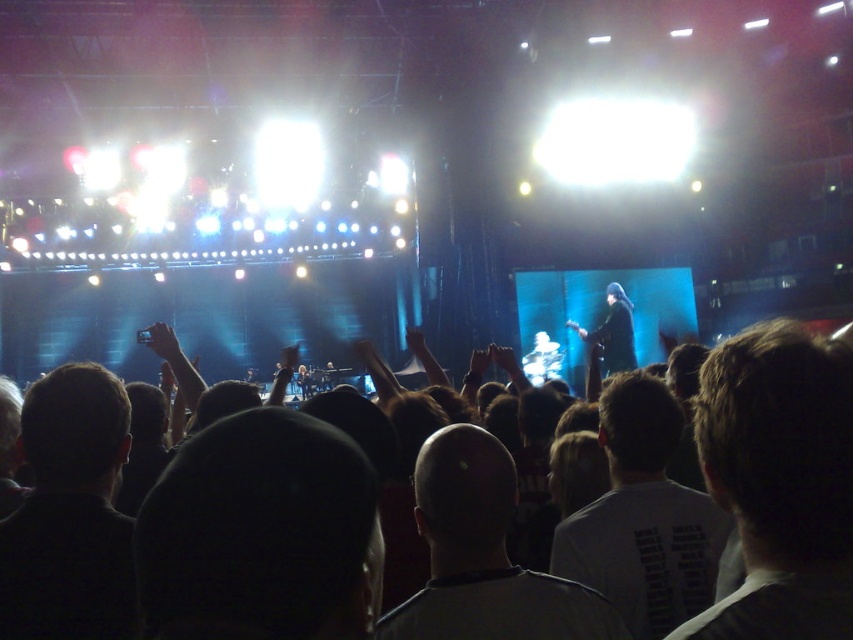
Question: Which object appears farthest from the camera in this image?

Choices:
 (A) bald head at center
 (B) dark hair at upper right

Answer: (A)

Question: Which point is farther from the camera taking this photo?

Choices:
 (A) (241, 602)
 (B) (453, 472)

Answer: (B)

Question: Is white t-shirt at center to the left of bald head at center from the viewer's perspective?

Choices:
 (A) yes
 (B) no

Answer: (B)

Question: Which point appears farthest from the camera in this image?

Choices:
 (A) (738, 497)
 (B) (682, 502)
 (C) (730, 358)
 (D) (76, 461)

Answer: (B)

Question: Can you confirm if black fabric at center is smaller than dark hair at lower left?

Choices:
 (A) no
 (B) yes

Answer: (B)

Question: Does black fabric at center appear on the left side of dark hair at lower left?

Choices:
 (A) yes
 (B) no

Answer: (B)